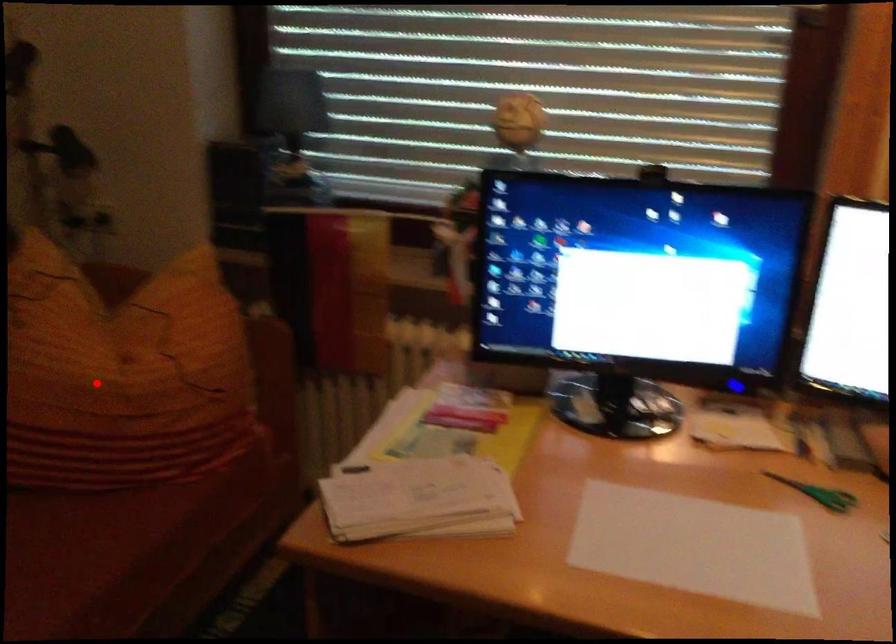
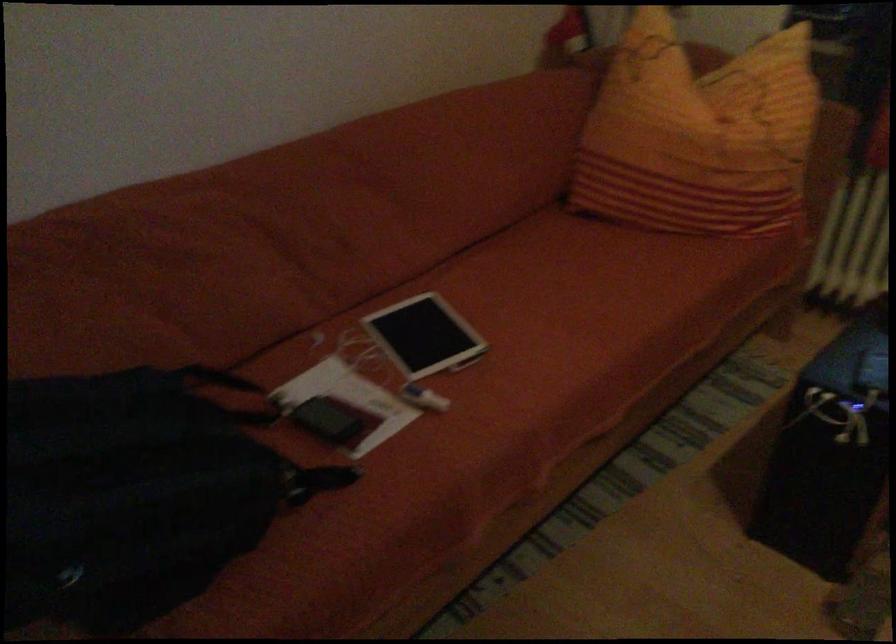
Question: A red point is marked in image1. In image2, is the corresponding 3D point closer to the camera or farther? Reply with the corresponding letter.

Choices:
 (A) The corresponding 3D point is closer.
 (B) The corresponding 3D point is farther.

Answer: (B)